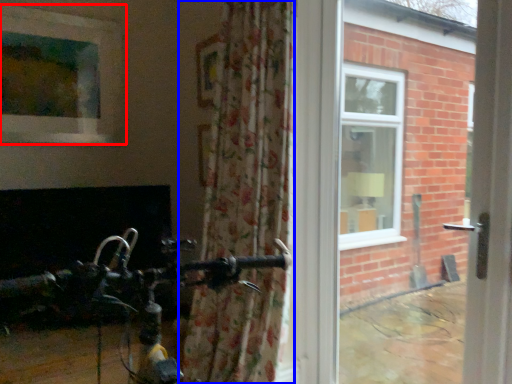
Question: Which of the following is the closest to the observer, window (highlighted by a red box) or curtain (highlighted by a blue box)?

Choices:
 (A) window
 (B) curtain

Answer: (B)